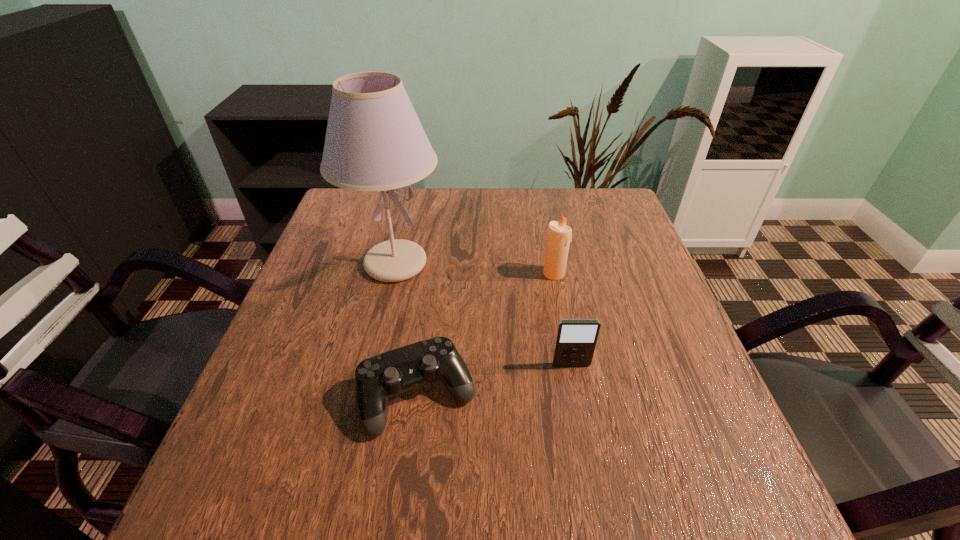
This screenshot has height=540, width=960. Identify the location of vacant region between the second tallest object and the shortest object. (486, 334).

Identify the location of vacant area that lies between the tallest object and the candle. (475, 269).

I want to click on free space between the second shortest object and the lampshade, so click(x=483, y=314).

Locate an element on the screen. free space that is in between the third tallest object and the tallest object is located at coordinates (483, 314).

Identify which object is located as the third nearest to the candle. Please provide its 2D coordinates. Your answer should be formatted as a tuple, i.e. [(x, y)], where the tuple contains the x and y coordinates of a point satisfying the conditions above.

[(377, 378)]

Select which object appears as the third closest to the third tallest object. Please provide its 2D coordinates. Your answer should be formatted as a tuple, i.e. [(x, y)], where the tuple contains the x and y coordinates of a point satisfying the conditions above.

[(374, 141)]